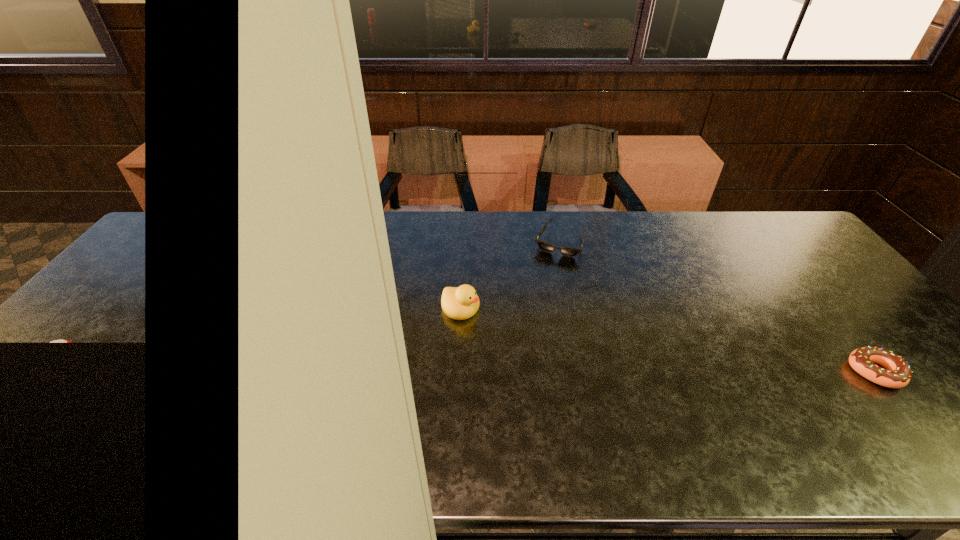
Identify the location of vacant position located 0.270m on the face of the duckling. pyautogui.click(x=564, y=362).

Locate an element on the screen. The image size is (960, 540). vacant space located on the face of the duckling is located at coordinates (582, 371).

I want to click on free region located 0.310m on the face of the duckling, so click(578, 369).

In order to click on object that is positioned at the far edge in this screenshot , I will do `click(544, 246)`.

I want to click on object present at the near edge, so click(x=897, y=373).

The height and width of the screenshot is (540, 960). I want to click on object that is at the right edge, so click(x=897, y=373).

Find the location of a particular element. This screenshot has height=540, width=960. object present at the near right corner is located at coordinates (897, 373).

In the image, there is a desktop. At what (x,y) coordinates should I click in order to perform the action: click on vacant region at the far edge. Please return your answer as a coordinate pair (x, y). The image size is (960, 540). Looking at the image, I should click on (580, 238).

This screenshot has height=540, width=960. In the image, there is a desktop. What are the coordinates of `vacant space at the near edge` in the screenshot? It's located at (229, 387).

Locate an element on the screen. vacant space at the left edge of the desktop is located at coordinates (91, 314).